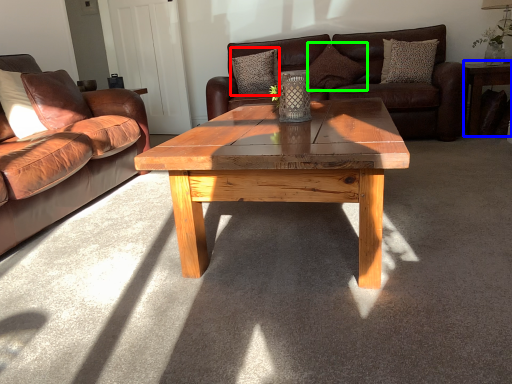
Question: Which is nearer to the pillow (highlighted by a red box)? side table (highlighted by a blue box) or pillow (highlighted by a green box).

Choices:
 (A) side table
 (B) pillow

Answer: (B)